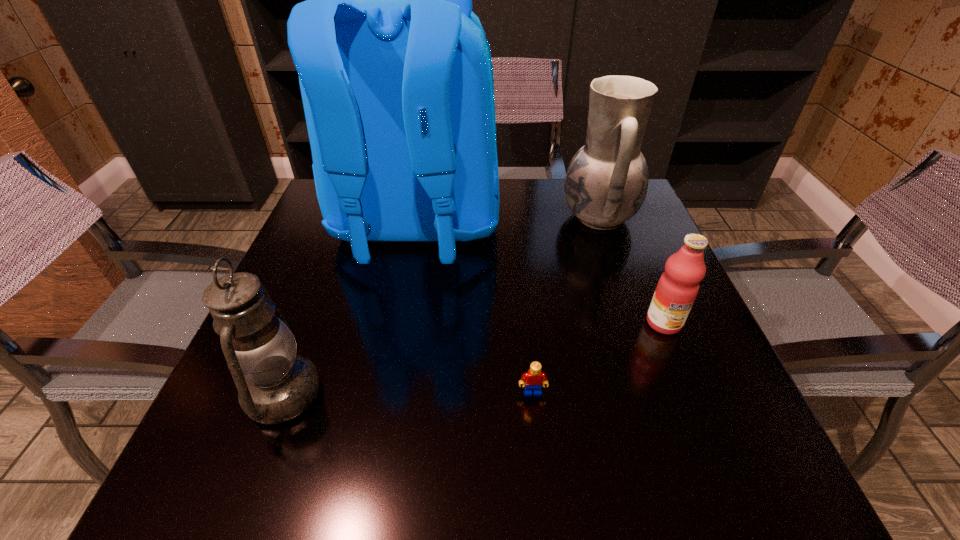
Where is `vacant area situated 0.150m on the front-facing side of the pitcher`? vacant area situated 0.150m on the front-facing side of the pitcher is located at coordinates (504, 217).

The image size is (960, 540). In order to click on free space located 0.210m on the right of the oil lamp in this screenshot , I will do `click(440, 394)`.

I want to click on vacant space situated on the label of the fourth tallest object, so click(682, 365).

This screenshot has height=540, width=960. Identify the location of free spot located 0.050m on the front-facing side of the third object from right to left. (536, 423).

Identify the location of backpack present at the far edge. (395, 71).

I want to click on pitcher that is at the far edge, so click(x=606, y=183).

This screenshot has width=960, height=540. Identify the location of object that is positioned at the near edge. (275, 385).

Locate an element on the screen. backpack that is at the left edge is located at coordinates (395, 71).

Locate an element on the screen. Image resolution: width=960 pixels, height=540 pixels. oil lamp that is at the left edge is located at coordinates (275, 385).

Find the location of `pitcher located at the right edge`. pitcher located at the right edge is located at coordinates (606, 183).